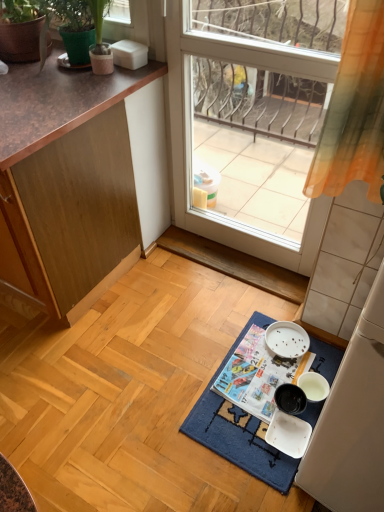
Question: From the image's perspective, is green textured pot at upper left above printed paper magazine at center?

Choices:
 (A) no
 (B) yes

Answer: (B)

Question: Is green textured pot at upper left closer to the viewer compared to printed paper magazine at center?

Choices:
 (A) yes
 (B) no

Answer: (A)

Question: Can you confirm if green textured pot at upper left is taller than printed paper magazine at center?

Choices:
 (A) yes
 (B) no

Answer: (A)

Question: From the image's perspective, is green textured pot at upper left beneath printed paper magazine at center?

Choices:
 (A) no
 (B) yes

Answer: (A)

Question: Is green textured pot at upper left bigger than printed paper magazine at center?

Choices:
 (A) no
 (B) yes

Answer: (B)

Question: In terms of size, does green matte flowerpot at upper left appear bigger or smaller than wooden cabinet at left?

Choices:
 (A) big
 (B) small

Answer: (B)

Question: From their relative heights in the image, would you say green matte flowerpot at upper left is taller or shorter than wooden cabinet at left?

Choices:
 (A) short
 (B) tall

Answer: (A)

Question: Which is correct: green matte flowerpot at upper left is inside wooden cabinet at left, or outside of it?

Choices:
 (A) outside
 (B) inside

Answer: (A)

Question: In terms of width, does green matte flowerpot at upper left look wider or thinner when compared to wooden cabinet at left?

Choices:
 (A) thin
 (B) wide

Answer: (A)

Question: From a real-world perspective, relative to green matte flowerpot at upper left, is green textured pot at upper left vertically above or below?

Choices:
 (A) below
 (B) above

Answer: (B)

Question: Is green textured pot at upper left in front of or behind green matte flowerpot at upper left in the image?

Choices:
 (A) front
 (B) behind

Answer: (A)

Question: Looking at their shapes, would you say green textured pot at upper left is wider or thinner than green matte flowerpot at upper left?

Choices:
 (A) thin
 (B) wide

Answer: (B)

Question: Considering the positions of point (26, 10) and point (16, 56), is point (26, 10) closer or farther from the camera than point (16, 56)?

Choices:
 (A) closer
 (B) farther

Answer: (A)

Question: Looking at the image, does printed paper magazine at center seem bigger or smaller compared to transparent glass door at center?

Choices:
 (A) big
 (B) small

Answer: (B)

Question: From a real-world perspective, relative to transparent glass door at center, is printed paper magazine at center vertically above or below?

Choices:
 (A) above
 (B) below

Answer: (B)